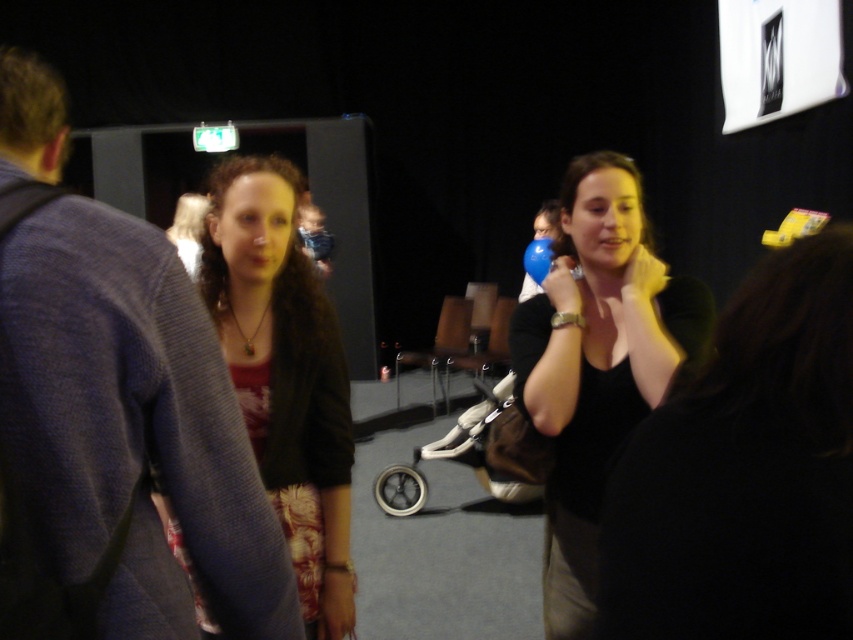
Question: Does matte black shirt at center have a lesser width compared to matte black jacket at center?

Choices:
 (A) yes
 (B) no

Answer: (B)

Question: Which point is farther from the camera taking this photo?

Choices:
 (A) (581, 230)
 (B) (335, 381)
 (C) (6, 244)

Answer: (A)

Question: Is dark blue sweater at left wider than matte black jacket at center?

Choices:
 (A) no
 (B) yes

Answer: (A)

Question: Which is farther from the matte black jacket at center?

Choices:
 (A) dark blue sweater at left
 (B) matte black shirt at center

Answer: (B)

Question: Which object appears closest to the camera in this image?

Choices:
 (A) dark blue sweater at left
 (B) matte black jacket at center
 (C) matte black shirt at center

Answer: (A)

Question: Does dark blue sweater at left appear over matte black jacket at center?

Choices:
 (A) yes
 (B) no

Answer: (A)